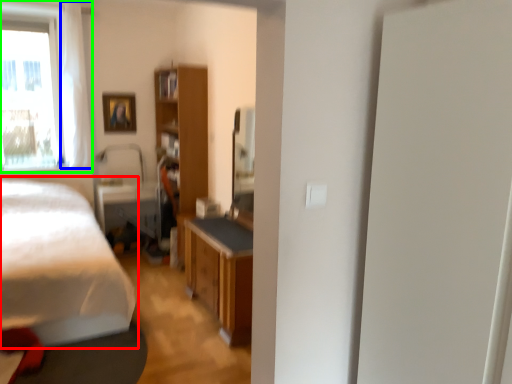
Question: Considering the real-world distances, which object is closest to bed (highlighted by a red box)? curtain (highlighted by a blue box) or window (highlighted by a green box).

Choices:
 (A) curtain
 (B) window

Answer: (A)